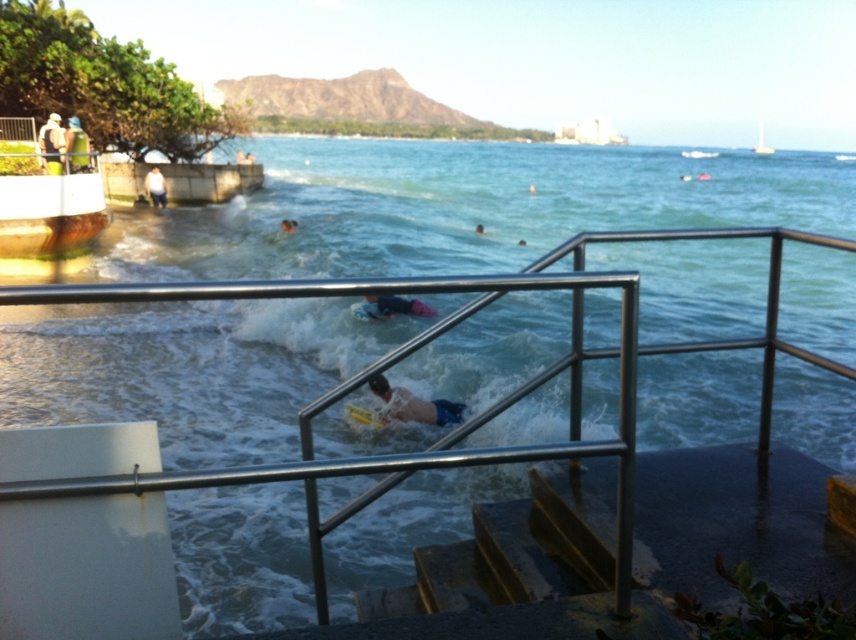
You are a photographer trying to capture a shot of both the rusty metal stairs at lower center and the white matte surfboard at center. From your current position, which object should you adjust your camera to focus on first if you want to include both in the frame?

The rusty metal stairs at lower center is positioned on the right side of the white matte surfboard at center, so you should focus on the white matte surfboard at center first to ensure both fit in the frame.

You are standing at the point marked as point (512, 554) on the image. What object is located at that point?

The rusty metal stairs at lower center are located at point (512, 554).

You are standing on the beach and want to reach the water. There are rusty metal stairs at lower center located at point (512, 554). Can you walk directly to the stairs from your current position?

Yes, you can walk directly to the rusty metal stairs at lower center located at point (512, 554) since there are no obstacles mentioned between your current position and the stairs.